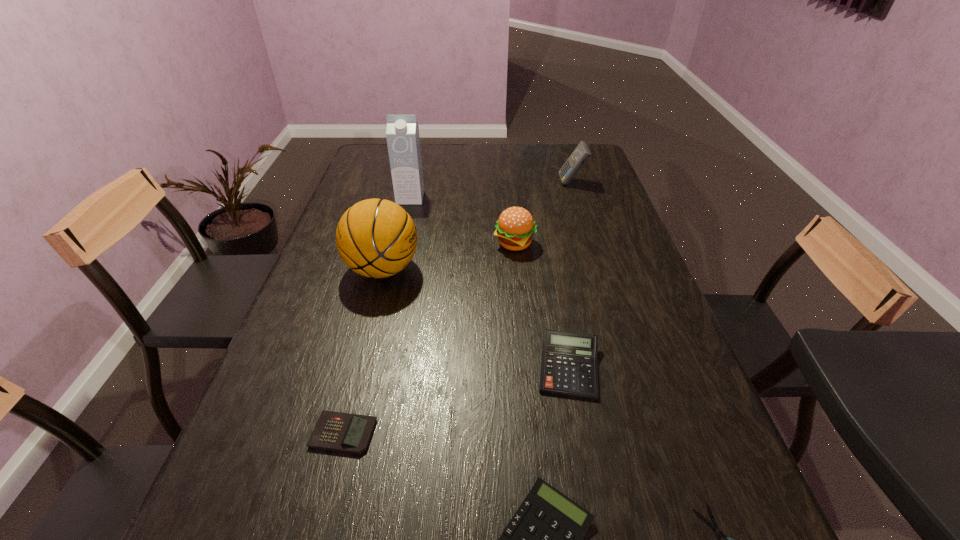
This screenshot has width=960, height=540. Identify the location of the second farthest object. (402, 132).

I want to click on carton, so click(402, 132).

Image resolution: width=960 pixels, height=540 pixels. What are the coordinates of `the seventh shortest object` in the screenshot? It's located at (376, 238).

The image size is (960, 540). I want to click on the sixth shortest object, so click(580, 155).

The image size is (960, 540). Identify the location of the farthest object. (580, 155).

The width and height of the screenshot is (960, 540). I want to click on hamburger, so click(x=514, y=228).

Where is `the fourth nearest object`? the fourth nearest object is located at coordinates (569, 360).

The width and height of the screenshot is (960, 540). Identify the location of the fifth tallest object. (569, 360).

The width and height of the screenshot is (960, 540). I want to click on the sixth farthest object, so (336, 431).

Locate an element on the screen. the second nearest calculator is located at coordinates (336, 431).